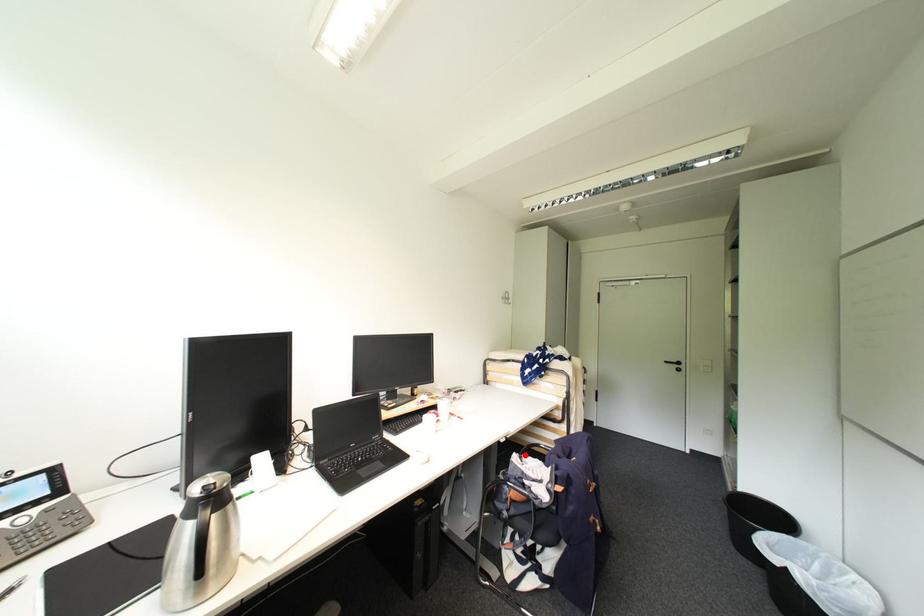
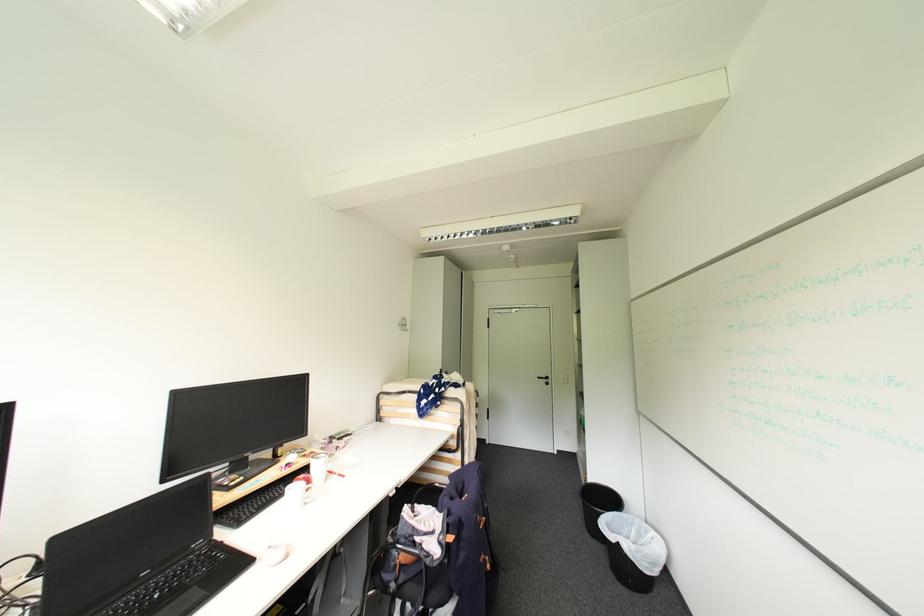
Question: I am providing you with two images of the same scene from different viewpoints. Given a red point in image1, look at the same physical point in image2. Is it:

Choices:
 (A) Closer to the viewpoint
 (B) Farther from the viewpoint

Answer: (A)